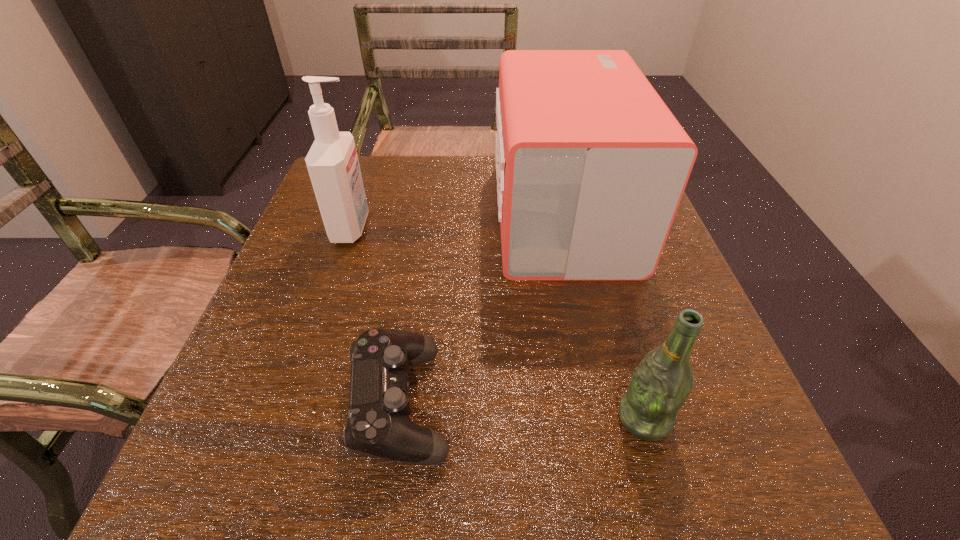
Identify the location of the leftmost object. (332, 162).

Locate an element on the screen. The height and width of the screenshot is (540, 960). box is located at coordinates (591, 165).

You are a GUI agent. You are given a task and a screenshot of the screen. Output one action in this format:
    pyautogui.click(x=<x>, y=<y>)
    Task: Click on the beer bottle
    The height and width of the screenshot is (540, 960).
    Given the screenshot: What is the action you would take?
    pyautogui.click(x=663, y=380)

Image resolution: width=960 pixels, height=540 pixels. I want to click on the second object from left to right, so click(x=379, y=425).

The image size is (960, 540). Find the location of `the shortest object`. the shortest object is located at coordinates (379, 425).

The width and height of the screenshot is (960, 540). What are the coordinates of `free space located on the front label of the cleansing agent` in the screenshot? It's located at (514, 227).

Where is `vacant region located on the surface of the box where the text is embossed`? vacant region located on the surface of the box where the text is embossed is located at coordinates (361, 215).

Locate an element on the screen. Image resolution: width=960 pixels, height=540 pixels. vacant space located 0.310m on the surface of the box where the text is embossed is located at coordinates (361, 215).

Identify the location of free point located on the surface of the box where the text is embossed. Image resolution: width=960 pixels, height=540 pixels. (426, 215).

At what (x,y) coordinates should I click in order to perform the action: click on free space located 0.250m on the surface of the second shortest object. Please return your answer as a coordinate pair (x, y). This screenshot has width=960, height=540. Looking at the image, I should click on (449, 418).